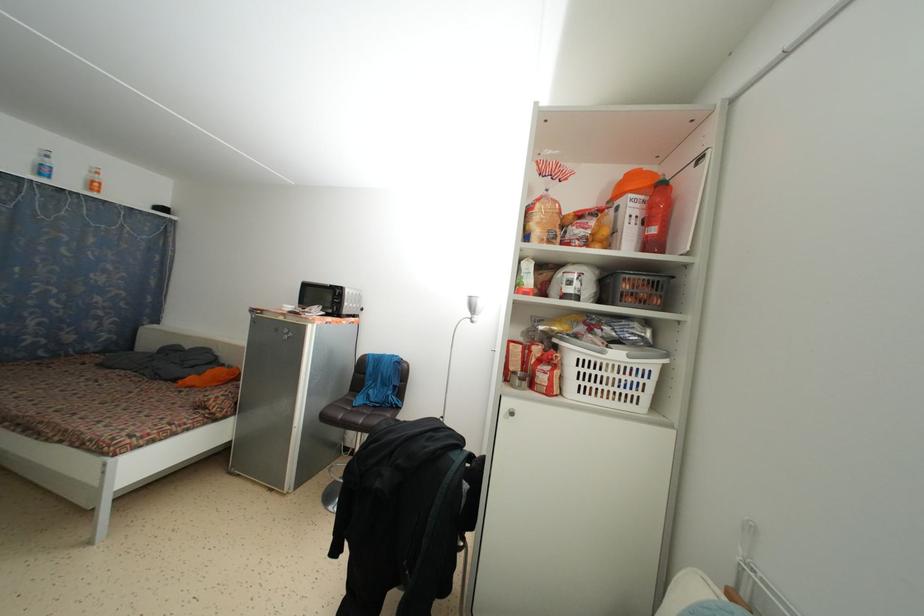
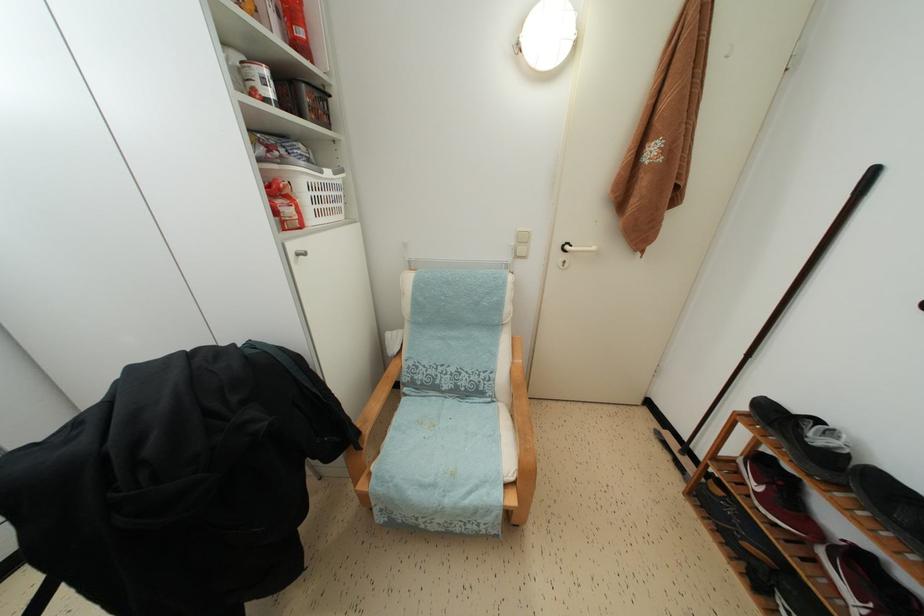
First-person continuous shooting, in which direction is the camera rotating?

The rotation direction of the camera is right-down.